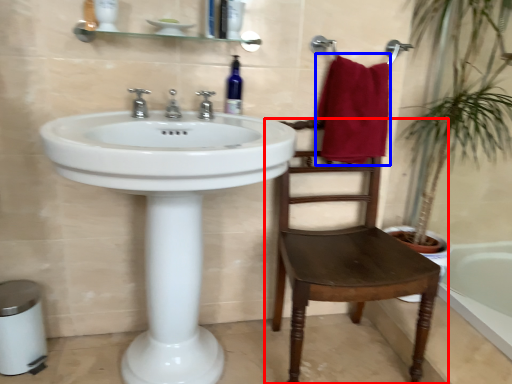
Question: Which object is further to the camera taking this photo, chair (highlighted by a red box) or bath towel (highlighted by a blue box)?

Choices:
 (A) chair
 (B) bath towel

Answer: (B)